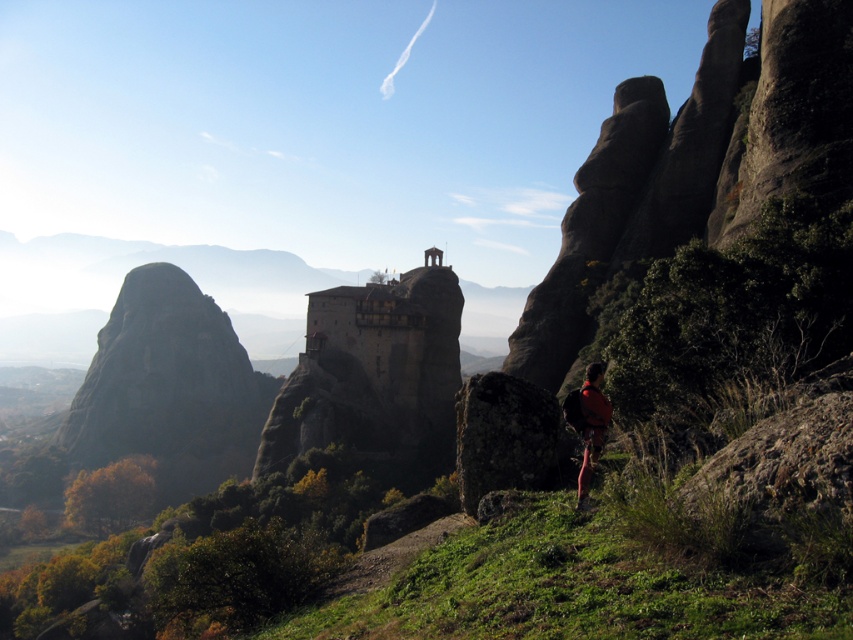
You are a hiker who wants to take a photo of the stone building at center and the rough textured rock at center. To ensure both are in the frame, where should you position yourself relative to them?

The stone building at center is below the rough textured rock at center. To capture both in the frame, position yourself at a lower elevation so you can look up to include the rock above and the building below.

You are a hiker who wants to take a photo of the stone building at center and the orange fabric backpack at lower right. Which object should you focus on first to ensure both are in the frame?

You should focus on the stone building at center first because it is closer to you than the orange fabric backpack at lower right, so adjusting the camera to include it will also capture the backpack in the background.

You are a hiker who has just reached the base of the rocky outcrop. You see the stone building at center and the orange fabric backpack at lower right. Which object is closer to your current position?

The orange fabric backpack at lower right is closer to your current position because it is located to the right of the stone building at center, which is further away.